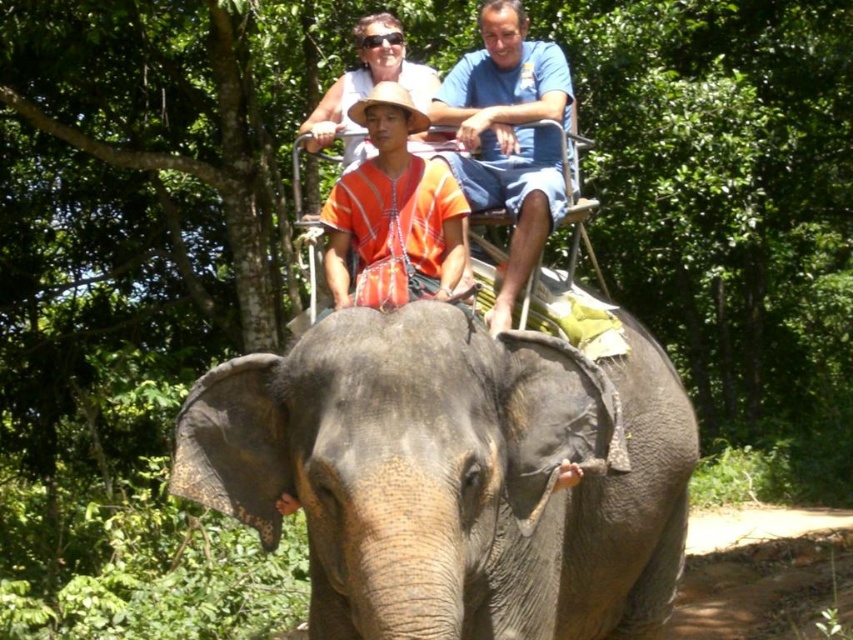
Question: Is gray textured elephant at center bigger than blue cotton shirt at upper center?

Choices:
 (A) yes
 (B) no

Answer: (A)

Question: From the image, what is the correct spatial relationship of gray textured elephant at center in relation to blue cotton shirt at upper center?

Choices:
 (A) right
 (B) left

Answer: (B)

Question: Does gray textured elephant at center lie in front of blue cotton shirt at upper center?

Choices:
 (A) yes
 (B) no

Answer: (A)

Question: Which of the following is the farthest from the observer?

Choices:
 (A) (560, 209)
 (B) (212, 424)

Answer: (A)

Question: Which of the following is the farthest from the observer?

Choices:
 (A) (450, 120)
 (B) (437, 493)

Answer: (A)

Question: Which of the following is the closest to the observer?

Choices:
 (A) gray textured elephant at center
 (B) blue cotton shirt at upper center

Answer: (A)